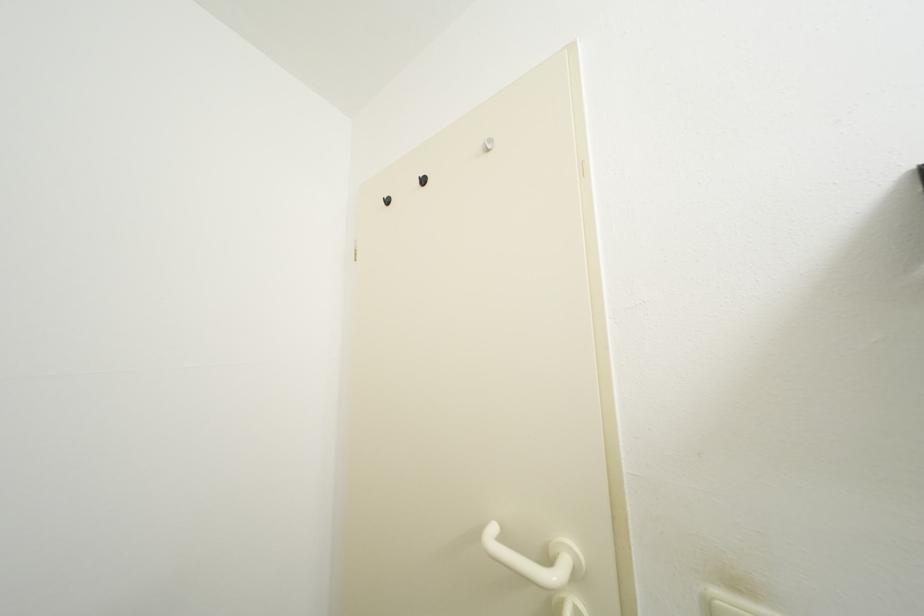
Locate an element on the screen. white door handle is located at coordinates (535, 560).